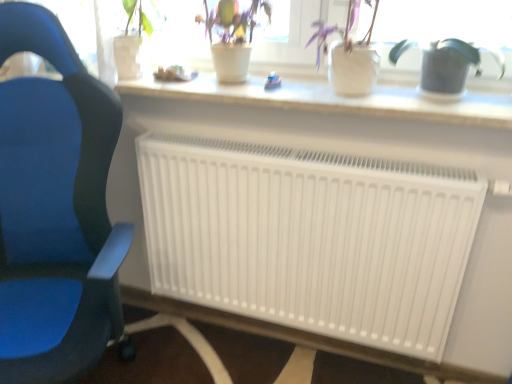
Question: Is blue fabric chair at left placed right next to white matte radiator at center?

Choices:
 (A) no
 (B) yes

Answer: (A)

Question: Is blue fabric chair at left not inside white matte radiator at center?

Choices:
 (A) no
 (B) yes

Answer: (B)

Question: Can you confirm if blue fabric chair at left is bigger than white matte radiator at center?

Choices:
 (A) yes
 (B) no

Answer: (A)

Question: Considering the relative sizes of blue fabric chair at left and white matte radiator at center in the image provided, is blue fabric chair at left smaller than white matte radiator at center?

Choices:
 (A) yes
 (B) no

Answer: (B)

Question: Is blue fabric chair at left surrounding white matte radiator at center?

Choices:
 (A) yes
 (B) no

Answer: (B)

Question: From the image's perspective, is blue fabric chair at left located beneath white matte radiator at center?

Choices:
 (A) no
 (B) yes

Answer: (A)

Question: Would you say white matte pot at upper center, which appears as the second houseplant when viewed from the left, is part of blue fabric chair at left's contents?

Choices:
 (A) no
 (B) yes

Answer: (A)

Question: Does blue fabric chair at left have a larger size compared to white matte pot at upper center, the second houseplant viewed from the right?

Choices:
 (A) no
 (B) yes

Answer: (B)

Question: Can you confirm if blue fabric chair at left is shorter than white matte pot at upper center, the second houseplant viewed from the right?

Choices:
 (A) yes
 (B) no

Answer: (B)

Question: Is blue fabric chair at left outside of white matte pot at upper center, which appears as the second houseplant when viewed from the left?

Choices:
 (A) yes
 (B) no

Answer: (A)

Question: Is blue fabric chair at left in contact with white matte pot at upper center, which appears as the second houseplant when viewed from the left?

Choices:
 (A) yes
 (B) no

Answer: (B)

Question: From a real-world perspective, is blue fabric chair at left physically below white matte pot at upper center, the second houseplant viewed from the right?

Choices:
 (A) no
 (B) yes

Answer: (B)

Question: Does green matte plant at upper center, which is the 1th houseplant from left to right, have a greater height compared to white matte pot at upper center, the second houseplant viewed from the right?

Choices:
 (A) no
 (B) yes

Answer: (A)